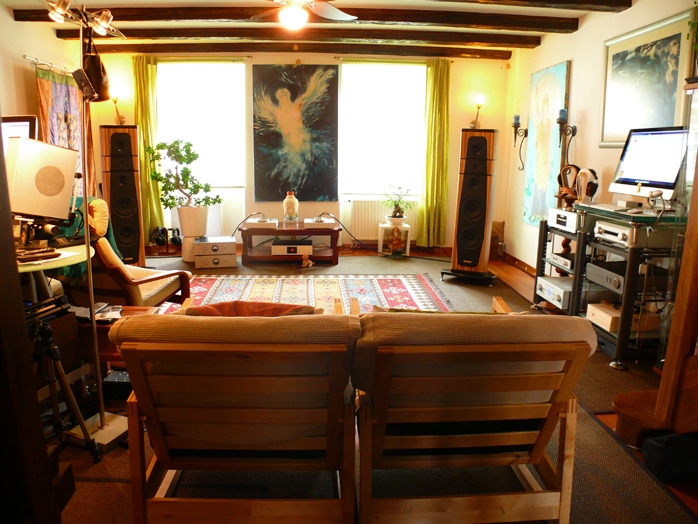
Where is `rug`? rug is located at coordinates (387, 288).